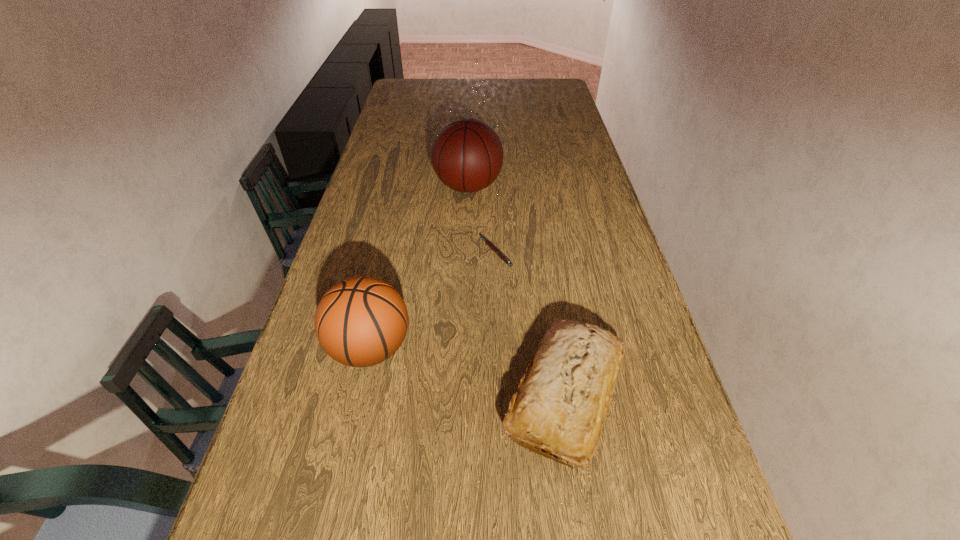
Where is `the taller basketball`? The width and height of the screenshot is (960, 540). the taller basketball is located at coordinates (467, 155).

Identify the location of the tallest object. (467, 155).

Where is `the second tallest object`? This screenshot has width=960, height=540. the second tallest object is located at coordinates (361, 321).

I want to click on the shorter basketball, so click(361, 321).

Locate an element on the screen. The image size is (960, 540). the third tallest object is located at coordinates (562, 400).

I want to click on pen, so click(x=499, y=253).

I want to click on the third nearest object, so click(499, 253).

Find the location of `vacant region located 0.220m on the back of the tallest object`. vacant region located 0.220m on the back of the tallest object is located at coordinates (469, 141).

The image size is (960, 540). Identify the location of free region located on the front of the nearer basketball. (344, 468).

Image resolution: width=960 pixels, height=540 pixels. I want to click on blank area located on the back of the bread, so click(x=549, y=290).